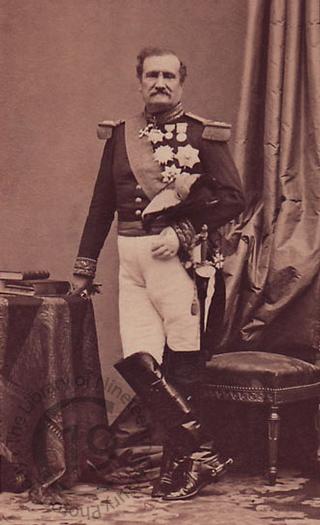
Locate an element on the screen. table cloth is located at coordinates (75, 364).